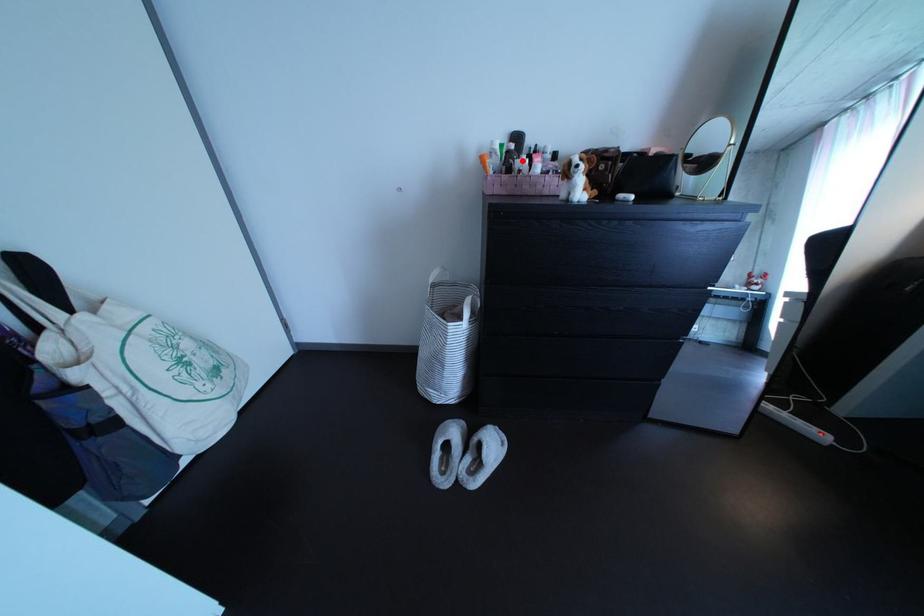
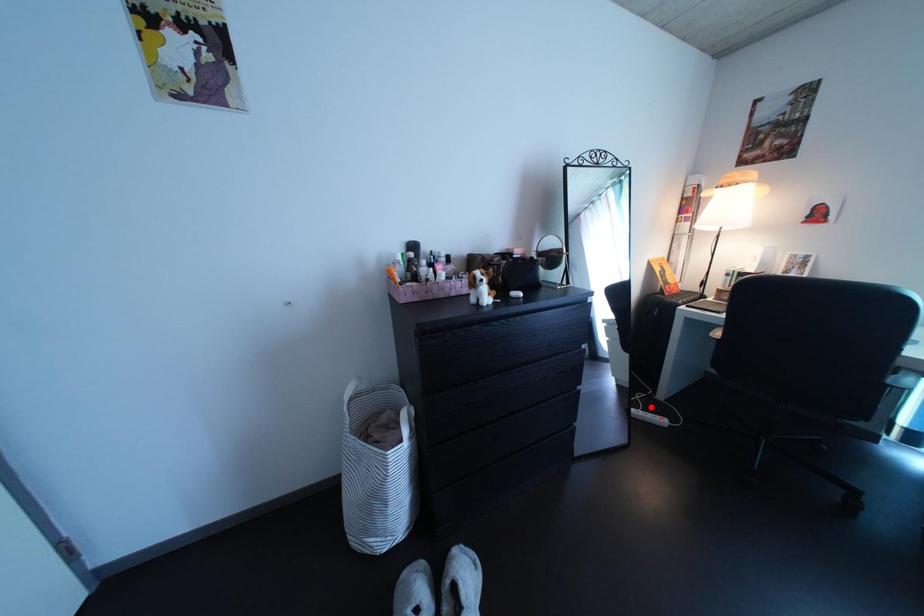
I am providing you with two images of the same scene from different viewpoints. A red point is marked on the first image and another point is marked on the second image. Are the points marked in image1 and image2 representing the same 3D position?

No